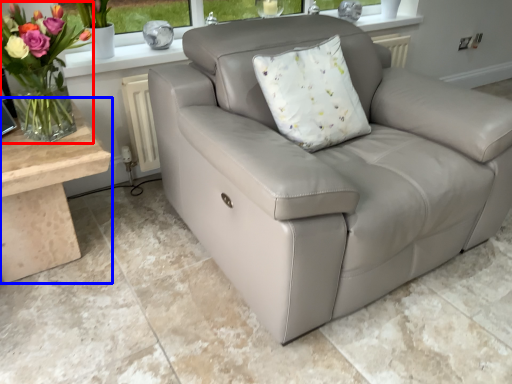
Question: Which object is closer to the camera taking this photo, floral arrangement (highlighted by a red box) or table (highlighted by a blue box)?

Choices:
 (A) floral arrangement
 (B) table

Answer: (A)